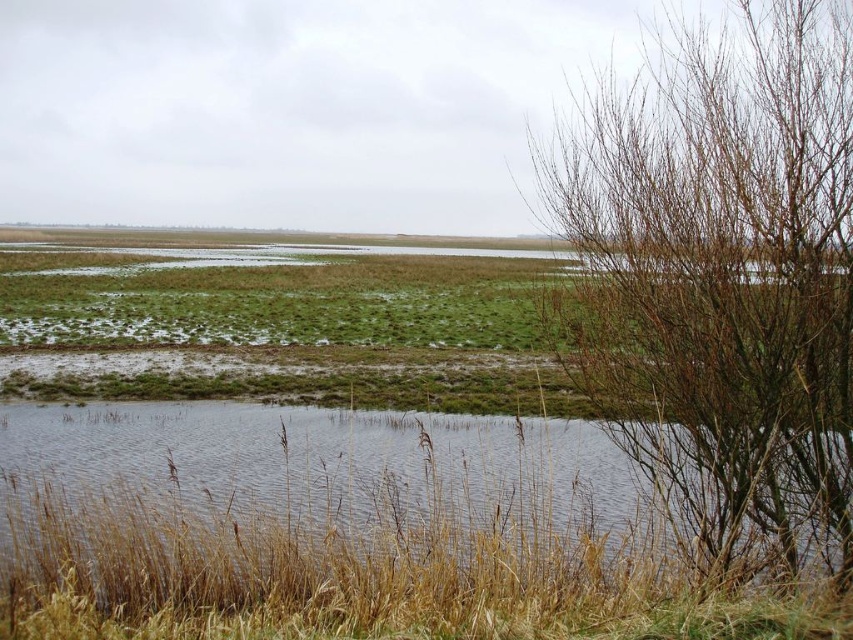
Question: Which point is farther to the camera?

Choices:
 (A) (486, 524)
 (B) (726, 209)

Answer: (A)

Question: Considering the relative positions of brown grass at lower left and bare branches at right in the image provided, where is brown grass at lower left located with respect to bare branches at right?

Choices:
 (A) left
 (B) right

Answer: (A)

Question: Does brown grass at lower left have a lesser width compared to bare branches at right?

Choices:
 (A) no
 (B) yes

Answer: (B)

Question: Does brown grass at lower left appear on the left side of bare branches at right?

Choices:
 (A) yes
 (B) no

Answer: (A)